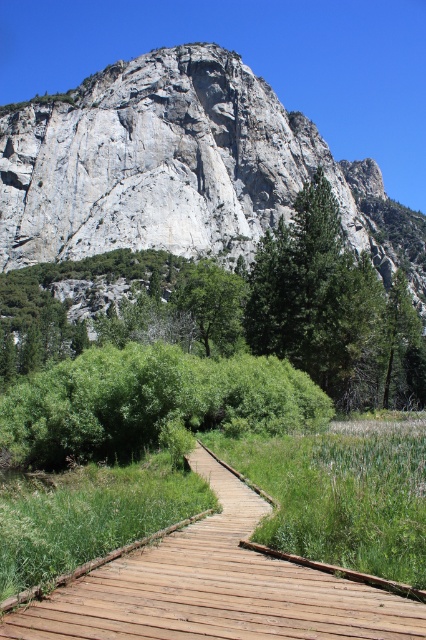
You are a hiker standing on the brown wooden boardwalk at center. Looking towards the gray rock formation at upper center, which direction should you head to reach it?

The gray rock formation at upper center is to the right of the brown wooden boardwalk at center, so you should head to the right to reach it.

You are standing on the brown wooden boardwalk at center and want to take a photo of the green leafy tree at center. Since the boardwalk is lower than the tree, will you have to look up or down to frame the tree in your camera?

The brown wooden boardwalk at center is not as tall as green leafy tree at center, so you will have to look up to frame the tree in your camera.